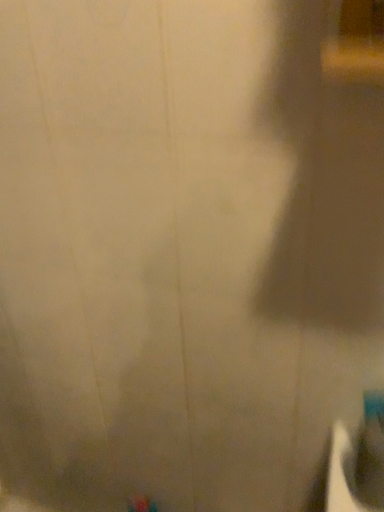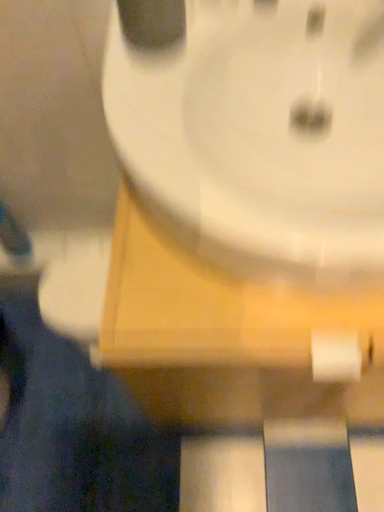
Question: Which way did the camera rotate in the video?

Choices:
 (A) rotated right
 (B) rotated left

Answer: (A)